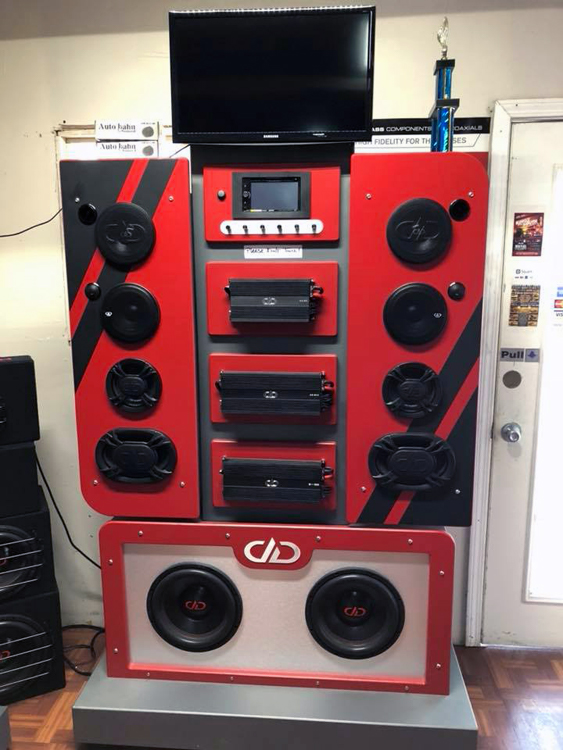
Find the location of `small screen`. small screen is located at coordinates (276, 193).